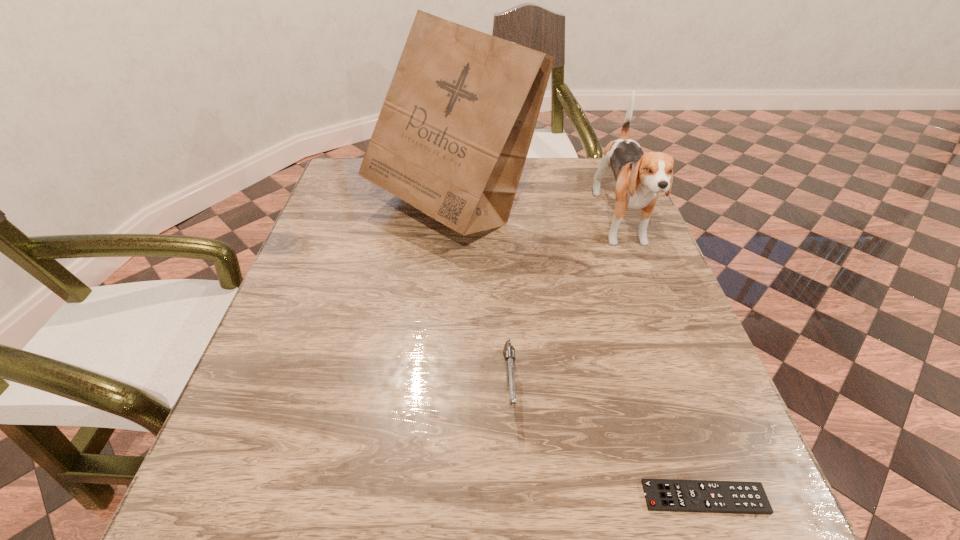
Find the location of `grocery bag`. grocery bag is located at coordinates (452, 137).

At what (x,y) coordinates should I click in order to perform the action: click on the second tallest object. Please return your answer as a coordinate pair (x, y). The width and height of the screenshot is (960, 540). Looking at the image, I should click on (640, 177).

Where is `the third farthest object`? Image resolution: width=960 pixels, height=540 pixels. the third farthest object is located at coordinates (509, 351).

Locate an element on the screen. This screenshot has width=960, height=540. the third tallest object is located at coordinates (509, 351).

This screenshot has height=540, width=960. I want to click on remote control, so click(736, 497).

This screenshot has height=540, width=960. I want to click on the shortest object, so click(736, 497).

Identify the location of vacant space located 0.230m on the right of the grocery bag. (x=627, y=210).

At what (x,y) coordinates should I click in order to perform the action: click on vacant space located at the face of the puppy. Please return your answer as a coordinate pair (x, y). The width and height of the screenshot is (960, 540). Looking at the image, I should click on (653, 308).

Locate an element on the screen. The height and width of the screenshot is (540, 960). vacant space situated aiming along the barrel of the second shortest object is located at coordinates (516, 493).

Locate an element on the screen. free space located on the back of the shortest object is located at coordinates (649, 337).